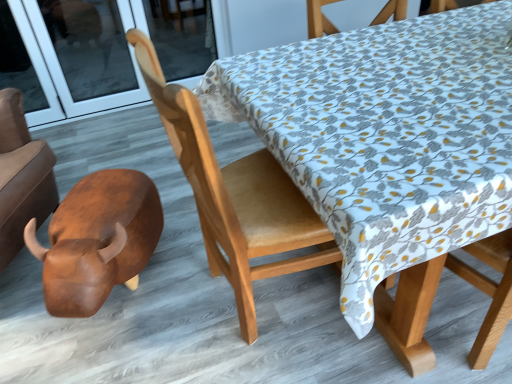
Question: Is light brown wood chair at center facing away from transparent glass door at upper left?

Choices:
 (A) yes
 (B) no

Answer: (B)

Question: Can you confirm if light brown wood chair at center is shorter than transparent glass door at upper left?

Choices:
 (A) no
 (B) yes

Answer: (A)

Question: Is light brown wood chair at center wider than transparent glass door at upper left?

Choices:
 (A) no
 (B) yes

Answer: (B)

Question: Is light brown wood chair at center positioned beyond the bounds of transparent glass door at upper left?

Choices:
 (A) yes
 (B) no

Answer: (A)

Question: Is light brown wood chair at center not near transparent glass door at upper left?

Choices:
 (A) no
 (B) yes

Answer: (B)

Question: From a real-world perspective, is light brown wood chair at center positioned over transparent glass door at upper left based on gravity?

Choices:
 (A) yes
 (B) no

Answer: (A)

Question: Does transparent glass door at upper left lie in front of light brown wood chair at center?

Choices:
 (A) no
 (B) yes

Answer: (A)

Question: Considering the relative sizes of transparent glass door at upper left and light brown wood chair at center in the image provided, is transparent glass door at upper left smaller than light brown wood chair at center?

Choices:
 (A) yes
 (B) no

Answer: (A)

Question: Is transparent glass door at upper left touching light brown wood chair at center?

Choices:
 (A) yes
 (B) no

Answer: (B)

Question: Considering the relative positions of transparent glass door at upper left and light brown wood chair at center in the image provided, is transparent glass door at upper left to the left of light brown wood chair at center from the viewer's perspective?

Choices:
 (A) no
 (B) yes

Answer: (B)

Question: Does transparent glass door at upper left have a larger size compared to light brown wood chair at center?

Choices:
 (A) no
 (B) yes

Answer: (A)

Question: Would you say transparent glass door at upper left is a long distance from light brown wood chair at center?

Choices:
 (A) yes
 (B) no

Answer: (A)

Question: Is the position of transparent glass door at upper left less distant than that of brown polished wood bull at lower left?

Choices:
 (A) no
 (B) yes

Answer: (A)